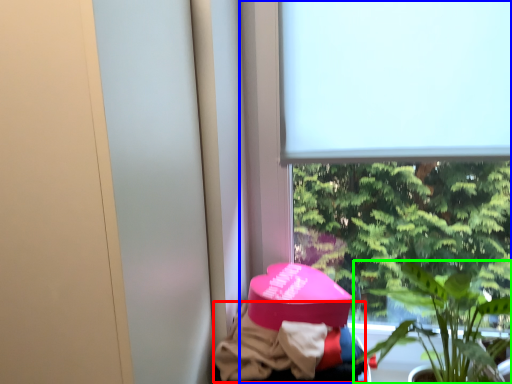
Question: Estimate the real-world distances between objects in this image. Which object is farther from clothing (highlighted by a red box), window (highlighted by a blue box) or houseplant (highlighted by a green box)?

Choices:
 (A) window
 (B) houseplant

Answer: (A)